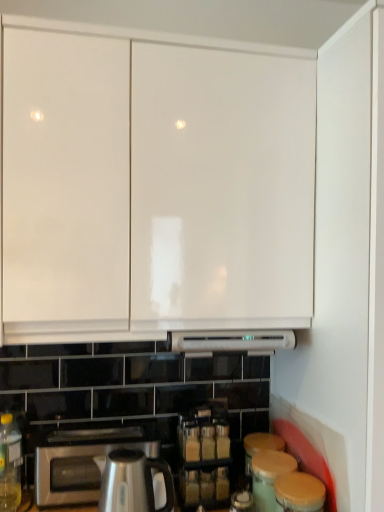
Question: Is translucent yellow bottle at lower left directly adjacent to white glossy cabinet at upper center?

Choices:
 (A) yes
 (B) no

Answer: (B)

Question: Does translucent yellow bottle at lower left have a lesser width compared to white glossy cabinet at upper center?

Choices:
 (A) yes
 (B) no

Answer: (A)

Question: Is translucent yellow bottle at lower left far away from white glossy cabinet at upper center?

Choices:
 (A) no
 (B) yes

Answer: (A)

Question: Is translucent yellow bottle at lower left wider than white glossy cabinet at upper center?

Choices:
 (A) yes
 (B) no

Answer: (B)

Question: Considering the relative positions of translucent yellow bottle at lower left and white glossy cabinet at upper center in the image provided, is translucent yellow bottle at lower left behind white glossy cabinet at upper center?

Choices:
 (A) no
 (B) yes

Answer: (B)

Question: From the image's perspective, is translucent yellow bottle at lower left below white glossy cabinet at upper center?

Choices:
 (A) no
 (B) yes

Answer: (B)

Question: Is white glossy cabinet at upper center smaller than satin silver toaster at lower left?

Choices:
 (A) no
 (B) yes

Answer: (A)

Question: Could you tell me if white glossy cabinet at upper center is facing satin silver toaster at lower left?

Choices:
 (A) yes
 (B) no

Answer: (B)

Question: Can you confirm if white glossy cabinet at upper center is bigger than satin silver toaster at lower left?

Choices:
 (A) yes
 (B) no

Answer: (A)

Question: Does white glossy cabinet at upper center come in front of satin silver toaster at lower left?

Choices:
 (A) yes
 (B) no

Answer: (A)

Question: Is white glossy cabinet at upper center touching satin silver toaster at lower left?

Choices:
 (A) no
 (B) yes

Answer: (A)

Question: From the image's perspective, is white glossy cabinet at upper center above satin silver toaster at lower left?

Choices:
 (A) no
 (B) yes

Answer: (B)

Question: Considering the relative sizes of white glossy cabinet at upper center and satin silver kettle at lower center in the image provided, is white glossy cabinet at upper center taller than satin silver kettle at lower center?

Choices:
 (A) yes
 (B) no

Answer: (A)